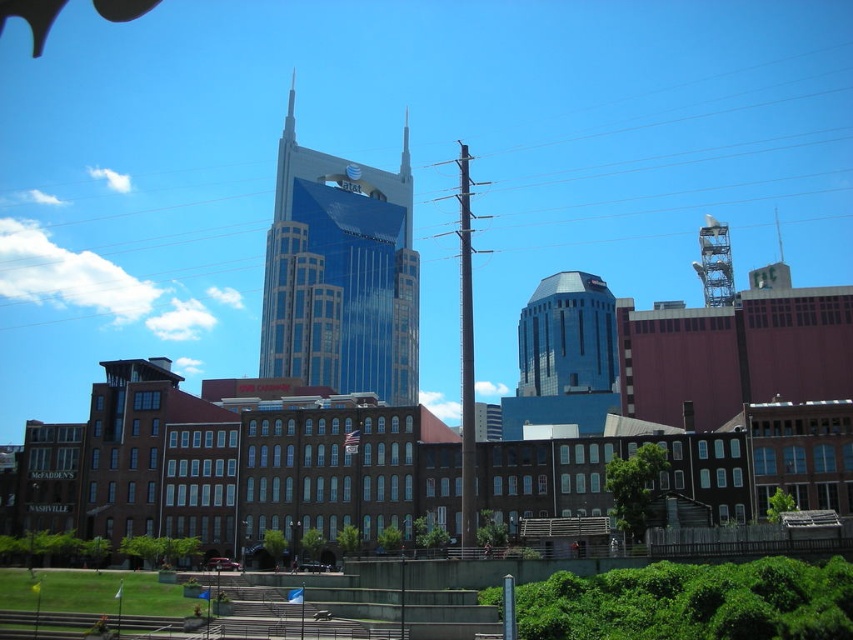
You are an architect designing a new building that needs to fit between the blue glassy skyscraper at center and the gold metallic spire at upper center. The new building must not block the view of either structure. Based on their sizes, which structure should the new building be closer to?

The blue glassy skyscraper at center is larger in size than the gold metallic spire at upper center, so the new building should be closer to the gold metallic spire at upper center to avoid blocking the view of the larger skyscraper.

You are an architect analyzing the urban layout. You notice the metallic lattice tower at upper right and the shiny glass spire at center. Which of these two structures is positioned lower in the image?

The metallic lattice tower at upper right is located below the shiny glass spire at center, so it is positioned lower in the image.